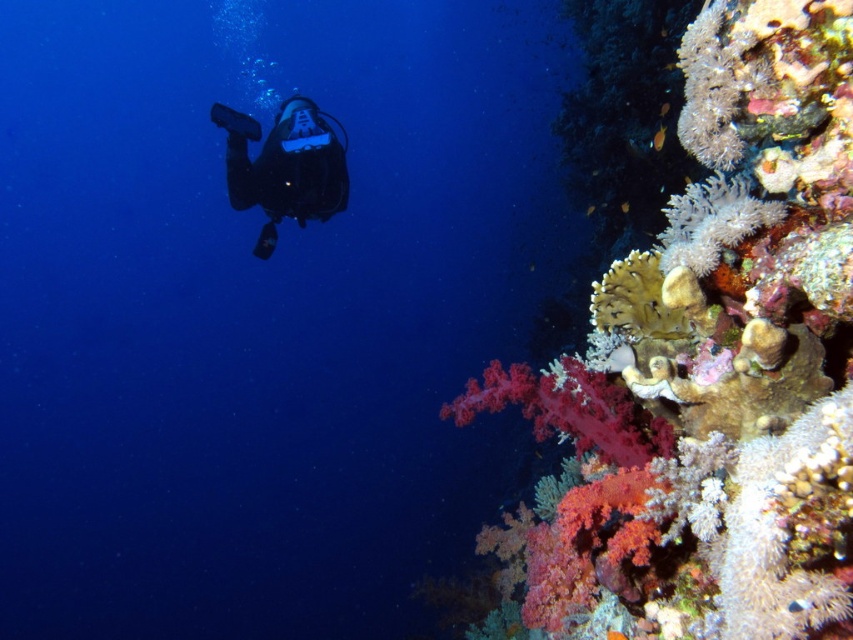
Question: Which object is farther from the camera taking this photo?

Choices:
 (A) soft coral at upper right
 (B) white fluffy coral at right

Answer: (B)

Question: Is soft coral at upper right wider than black matte scuba diver at center?

Choices:
 (A) no
 (B) yes

Answer: (B)

Question: Can you confirm if soft coral at upper right is positioned to the left of black matte scuba diver at center?

Choices:
 (A) no
 (B) yes

Answer: (A)

Question: Estimate the real-world distances between objects in this image. Which object is farther from the black matte scuba diver at center?

Choices:
 (A) soft coral at upper right
 (B) white fluffy coral at right

Answer: (B)

Question: Is soft coral at upper right wider than white fluffy coral at right?

Choices:
 (A) no
 (B) yes

Answer: (B)

Question: Estimate the real-world distances between objects in this image. Which object is closer to the soft coral at upper right?

Choices:
 (A) black matte scuba diver at center
 (B) white fluffy coral at right

Answer: (B)